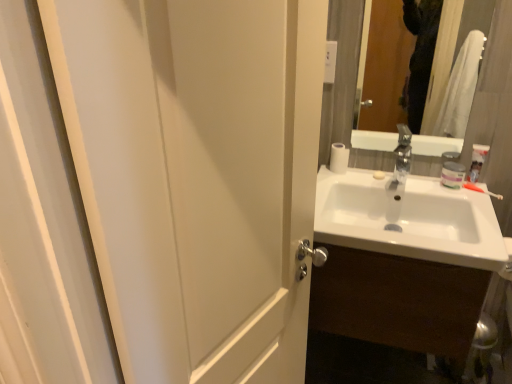
Question: Can you confirm if white matte jar at upper right is bigger than white glossy toothpaste at upper right?

Choices:
 (A) yes
 (B) no

Answer: (B)

Question: Is white matte jar at upper right aimed at white glossy toothpaste at upper right?

Choices:
 (A) yes
 (B) no

Answer: (B)

Question: Does white matte jar at upper right have a greater width compared to white glossy toothpaste at upper right?

Choices:
 (A) no
 (B) yes

Answer: (B)

Question: Considering the relative positions of white matte jar at upper right and white glossy toothpaste at upper right in the image provided, is white matte jar at upper right behind white glossy toothpaste at upper right?

Choices:
 (A) yes
 (B) no

Answer: (A)

Question: From a real-world perspective, is white matte jar at upper right physically above white glossy toothpaste at upper right?

Choices:
 (A) no
 (B) yes

Answer: (A)

Question: Would you say white matte jar at upper right is a long distance from white glossy toothpaste at upper right?

Choices:
 (A) yes
 (B) no

Answer: (B)

Question: Is white glossy sink at right located within white matte toilet paper at upper right?

Choices:
 (A) no
 (B) yes

Answer: (A)

Question: Would you consider white matte toilet paper at upper right to be distant from white glossy sink at right?

Choices:
 (A) no
 (B) yes

Answer: (A)

Question: Is the surface of white matte toilet paper at upper right in direct contact with white glossy sink at right?

Choices:
 (A) no
 (B) yes

Answer: (A)

Question: Would you say white matte toilet paper at upper right is outside white glossy sink at right?

Choices:
 (A) yes
 (B) no

Answer: (A)

Question: From a real-world perspective, is white matte toilet paper at upper right over white glossy sink at right?

Choices:
 (A) no
 (B) yes

Answer: (B)

Question: Considering the relative sizes of white matte toilet paper at upper right and white glossy sink at right in the image provided, is white matte toilet paper at upper right smaller than white glossy sink at right?

Choices:
 (A) no
 (B) yes

Answer: (B)

Question: Does white glossy sink at right come in front of white matte jar at upper right?

Choices:
 (A) yes
 (B) no

Answer: (A)